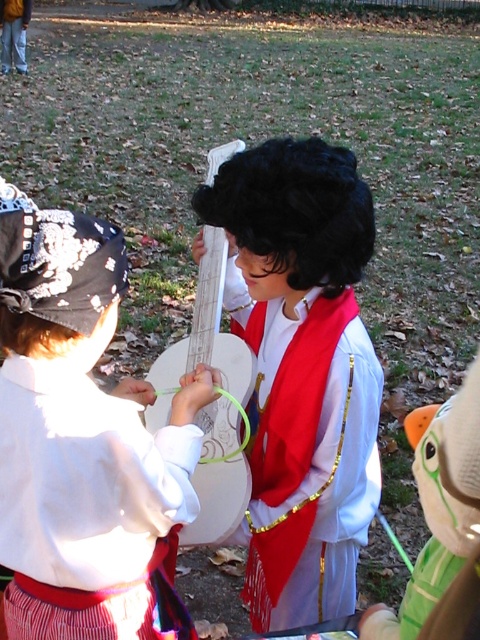
You are a photographer setting up for the event. You need to position a camera so that both the white cotton shirt at upper left and the matte black wig at center are visible in the frame. Based on their positions, which object should you ensure is closer to the camera to avoid it being blocked?

The white cotton shirt at upper left is above the matte black wig at center, so to avoid blocking the matte black wig at center, ensure the white cotton shirt at upper left is closer to the camera.

You are a photographer trying to capture both the white cotton shirt at upper left and the matte black wig at center in a single frame. Which object should you adjust your camera angle to focus on first to ensure both are in view?

The white cotton shirt at upper left is shorter than the matte black wig at center, so you should focus on the matte black wig at center first to ensure both are in view.

You are a photographer trying to capture a photo of both the white cotton shirt at upper left and the matte black wig at center. Given that your camera has a maximum focus range of 12 inches, can you fit both subjects within the frame without moving the camera?

The distance between the white cotton shirt at upper left and the matte black wig at center is 13.74 inches, which exceeds the camera focus range of 12 inches. Therefore, you cannot fit both within the frame without moving the camera.